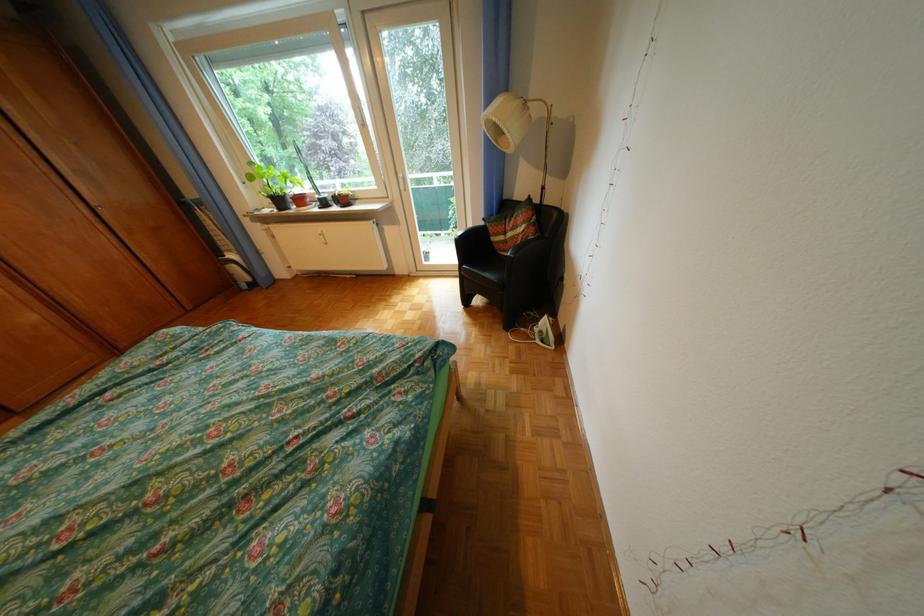
This screenshot has height=616, width=924. In order to click on white electric iron in this screenshot , I will do `click(538, 331)`.